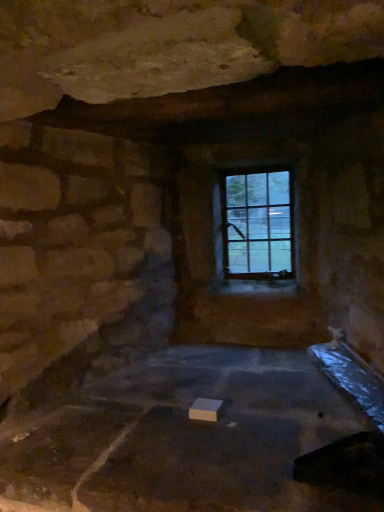
Question: From the image's perspective, is clear glass window at upper center over white matte block at center?

Choices:
 (A) yes
 (B) no

Answer: (A)

Question: Is clear glass window at upper center facing away from white matte block at center?

Choices:
 (A) no
 (B) yes

Answer: (A)

Question: Is clear glass window at upper center smaller than white matte block at center?

Choices:
 (A) no
 (B) yes

Answer: (B)

Question: Does clear glass window at upper center come in front of white matte block at center?

Choices:
 (A) yes
 (B) no

Answer: (B)

Question: Would you say white matte block at center is part of clear glass window at upper center's contents?

Choices:
 (A) no
 (B) yes

Answer: (A)

Question: Is clear glass window at upper center shorter than white matte block at center?

Choices:
 (A) yes
 (B) no

Answer: (B)

Question: Is white matte block at center shorter than clear glass window at upper center?

Choices:
 (A) yes
 (B) no

Answer: (A)

Question: Is white matte block at center facing away from clear glass window at upper center?

Choices:
 (A) no
 (B) yes

Answer: (A)

Question: Does white matte block at center have a larger size compared to clear glass window at upper center?

Choices:
 (A) no
 (B) yes

Answer: (B)

Question: Does white matte block at center appear on the right side of clear glass window at upper center?

Choices:
 (A) yes
 (B) no

Answer: (B)

Question: From the image's perspective, does white matte block at center appear lower than clear glass window at upper center?

Choices:
 (A) yes
 (B) no

Answer: (A)

Question: Is the position of white matte block at center less distant than that of clear glass window at upper center?

Choices:
 (A) no
 (B) yes

Answer: (B)

Question: Relative to clear glass window at upper center, is white matte block at center in front or behind?

Choices:
 (A) front
 (B) behind

Answer: (A)